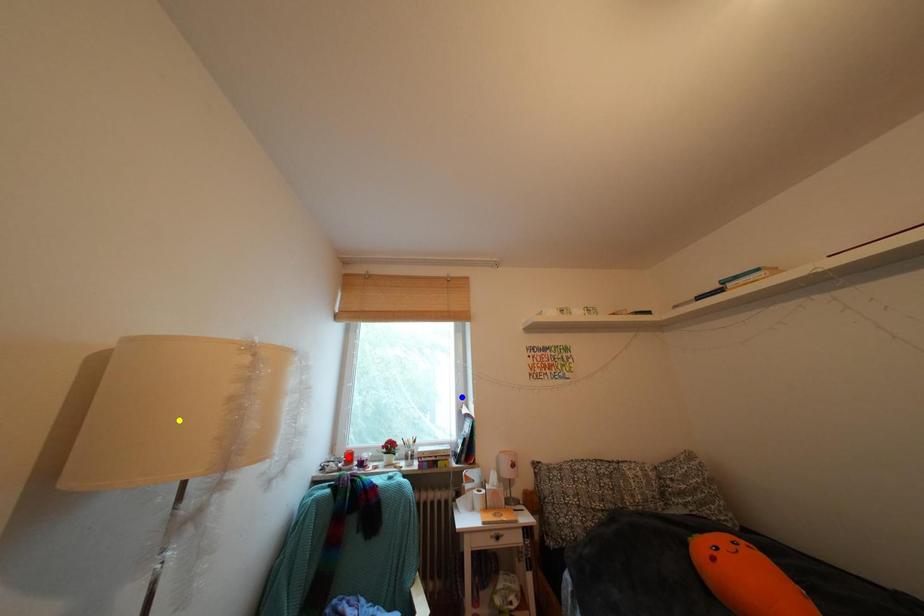
Order these from farthest to nearest:
yellow point
red point
blue point

blue point → red point → yellow point